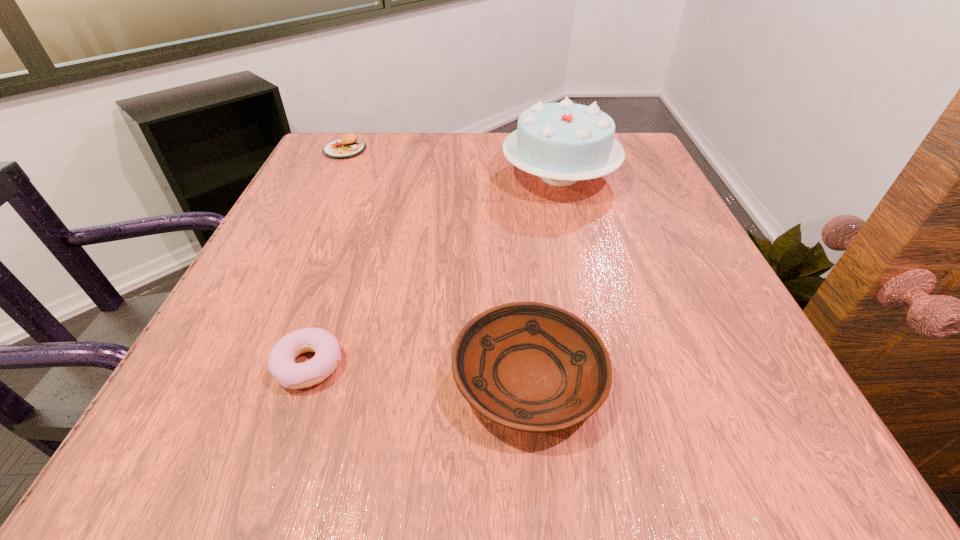
Where is `vacant space at the far right corner of the desktop`? Image resolution: width=960 pixels, height=540 pixels. vacant space at the far right corner of the desktop is located at coordinates (628, 150).

What are the coordinates of `free region at the near right corner` in the screenshot? It's located at (672, 403).

The image size is (960, 540). Identify the location of vacant space in between the tallest object and the plate. (544, 277).

Identify the location of free spot between the patty and the tallest object. The width and height of the screenshot is (960, 540). (452, 163).

At what (x,y) coordinates should I click in order to perform the action: click on vacant point located between the plate and the patty. Please return your answer as a coordinate pair (x, y). This screenshot has height=540, width=960. Looking at the image, I should click on (437, 264).

You are a GUI agent. You are given a task and a screenshot of the screen. Output one action in this format:
    pyautogui.click(x=<x>, y=<y>)
    Task: Click on the blank region between the shortest object and the plate
    
    Given the screenshot: What is the action you would take?
    pyautogui.click(x=419, y=372)

Identify the location of blank region between the shortest object and the birthday cake. The image size is (960, 540). (434, 271).

You are a GUI agent. You are given a task and a screenshot of the screen. Output one action in this format:
    pyautogui.click(x=<x>, y=<y>)
    Task: Click on the blank region between the birthday cake and the shortest object
    The height and width of the screenshot is (540, 960).
    Given the screenshot: What is the action you would take?
    pyautogui.click(x=434, y=271)

Locate an element on the screen. vacant space that is in between the patty and the shortest object is located at coordinates (326, 258).

Where is `free point between the doughnut and the plate`? free point between the doughnut and the plate is located at coordinates click(419, 372).